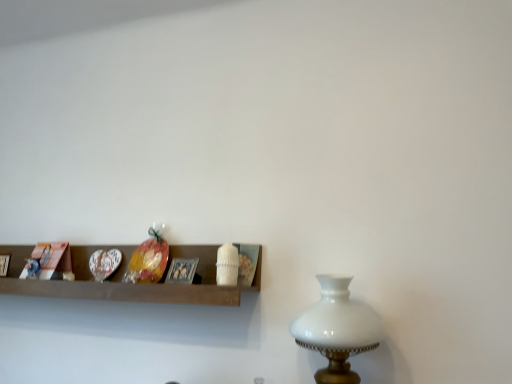
Question: From the image's perspective, is wooden shelf at center located above white glass table lamp at right?

Choices:
 (A) yes
 (B) no

Answer: (A)

Question: Is wooden shelf at center at the right side of white glass table lamp at right?

Choices:
 (A) no
 (B) yes

Answer: (A)

Question: Does wooden shelf at center have a lesser width compared to white glass table lamp at right?

Choices:
 (A) yes
 (B) no

Answer: (A)

Question: Does wooden shelf at center come in front of white glass table lamp at right?

Choices:
 (A) yes
 (B) no

Answer: (B)

Question: Is wooden shelf at center positioned beyond the bounds of white glass table lamp at right?

Choices:
 (A) yes
 (B) no

Answer: (A)

Question: Considering the positions of point (189, 271) and point (75, 276), is point (189, 271) closer or farther from the camera than point (75, 276)?

Choices:
 (A) closer
 (B) farther

Answer: (A)

Question: Is metallic silver picture frame at center spatially inside wooden shelf at center, or outside of it?

Choices:
 (A) inside
 (B) outside

Answer: (A)

Question: Looking at their shapes, would you say metallic silver picture frame at center is wider or thinner than wooden shelf at center?

Choices:
 (A) thin
 (B) wide

Answer: (A)

Question: In terms of height, does metallic silver picture frame at center look taller or shorter compared to wooden shelf at center?

Choices:
 (A) short
 (B) tall

Answer: (A)

Question: From the image's perspective, relative to metallic silver picture frame at center, is white glass table lamp at right above or below?

Choices:
 (A) above
 (B) below

Answer: (B)

Question: In the image, is white glass table lamp at right positioned in front of or behind metallic silver picture frame at center?

Choices:
 (A) behind
 (B) front

Answer: (B)

Question: Does point (359, 309) appear closer or farther from the camera than point (177, 281)?

Choices:
 (A) farther
 (B) closer

Answer: (B)

Question: Which is correct: white glass table lamp at right is inside metallic silver picture frame at center, or outside of it?

Choices:
 (A) outside
 (B) inside

Answer: (A)

Question: From a real-world perspective, is metallic silver picture frame at center physically located above or below white glass table lamp at right?

Choices:
 (A) below
 (B) above

Answer: (B)

Question: Does point (169, 266) appear closer or farther from the camera than point (296, 336)?

Choices:
 (A) farther
 (B) closer

Answer: (A)